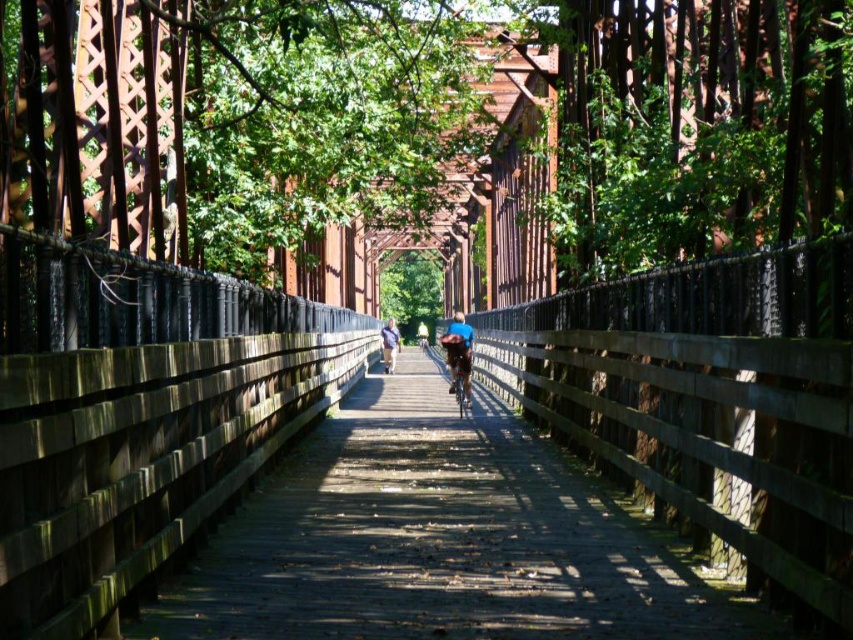
You are standing on the wooden pedestrian bridge and see both the shiny metallic bicycle at center and the blue denim jacket at center. Which object is nearer to you?

The shiny metallic bicycle at center is closer to the viewer than the blue denim jacket at center.